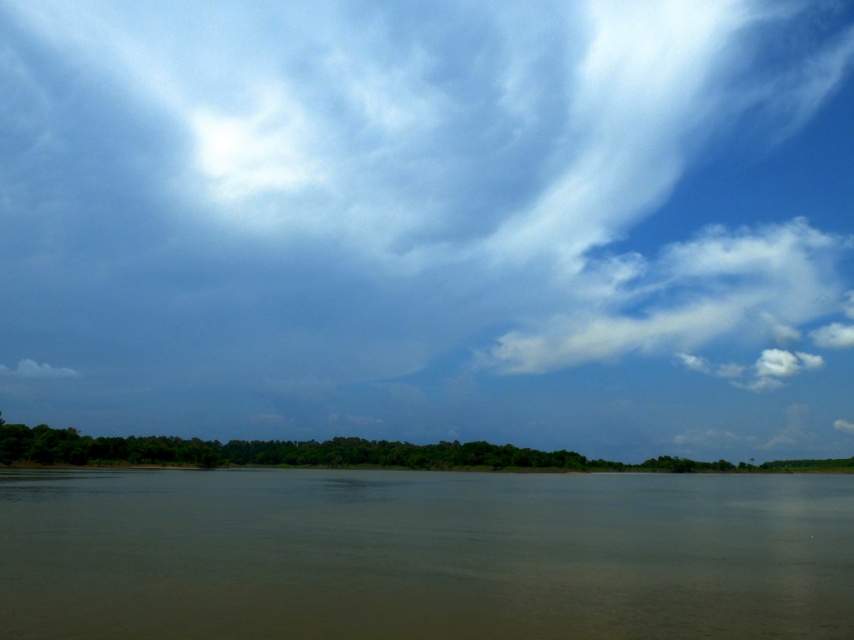
Is brown muddy water at center bigger than white fluffy cloud at lower left?

Yes.

Measure the distance between brown muddy water at center and camera.

A distance of 17.50 meters exists between brown muddy water at center and camera.

Who is more forward, (331,554) or (27,358)?

Point (331,554) is more forward.

The width and height of the screenshot is (854, 640). Identify the location of brown muddy water at center. coord(422,554).

What do you see at coordinates (431, 221) in the screenshot? This screenshot has width=854, height=640. I see `blue sky at upper center` at bounding box center [431, 221].

Who is higher up, blue sky at upper center or white fluffy cloud at lower left?

blue sky at upper center is higher up.

Is point (595, 205) positioned in front of point (9, 369)?

No, (595, 205) is behind (9, 369).

The height and width of the screenshot is (640, 854). I want to click on blue sky at upper center, so click(431, 221).

Can you confirm if blue sky at upper center is positioned to the right of white fluffy cloud at upper right?

Incorrect, blue sky at upper center is not on the right side of white fluffy cloud at upper right.

From the picture: Who is taller, blue sky at upper center or white fluffy cloud at upper right?

Standing taller between the two is blue sky at upper center.

Is point (670, 72) positioned in front of point (647, 339)?

No, (670, 72) is further to viewer.

This screenshot has width=854, height=640. In order to click on blue sky at upper center in this screenshot , I will do `click(431, 221)`.